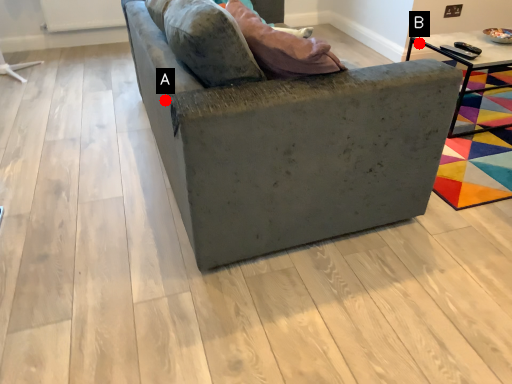
Question: Two points are circled on the image, labeled by A and B beside each circle. Which point is closer to the camera taking this photo?

Choices:
 (A) A is closer
 (B) B is closer

Answer: (A)